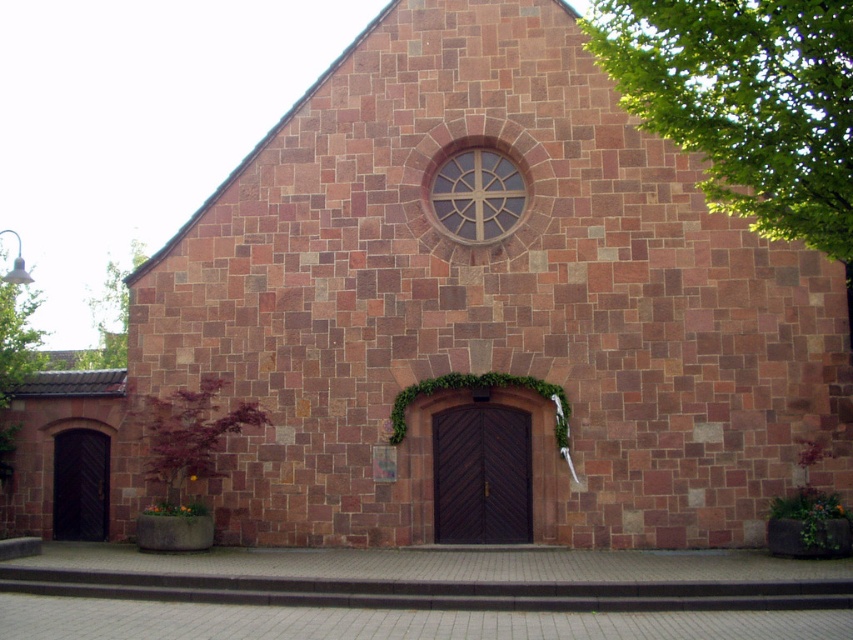
You are standing in front of the building and want to take a photo that includes both the green leafy tree at upper right and the circular window with a decorative starburst design above the entrance. Given that your camera has a maximum zoom of 50 meters, will you be able to capture both elements in a single frame without moving closer?

The green leafy tree at upper right is 17.27 meters away from the viewer. Since the camera can zoom up to 50 meters, which is greater than the distance to the tree, you can capture both elements in a single frame without moving closer.

You are standing in front of the building and want to take a photo that includes both the green leafy tree at upper right and the green leafy ivy at lower left. Which object should you position closer to the right side of your camera frame?

The green leafy tree at upper right should be positioned closer to the right side of your camera frame because it is on the right side of the green leafy ivy at lower left.

Looking at this image, you are standing in front of the building and want to take a photo that includes both the green leafy tree at upper right and the green leafy tree at upper left. Based on their positions, which tree should you adjust your camera angle to focus on first?

The green leafy tree at upper right is above the green leafy tree at upper left, so you should focus on the green leafy tree at upper right first to capture both in the frame.